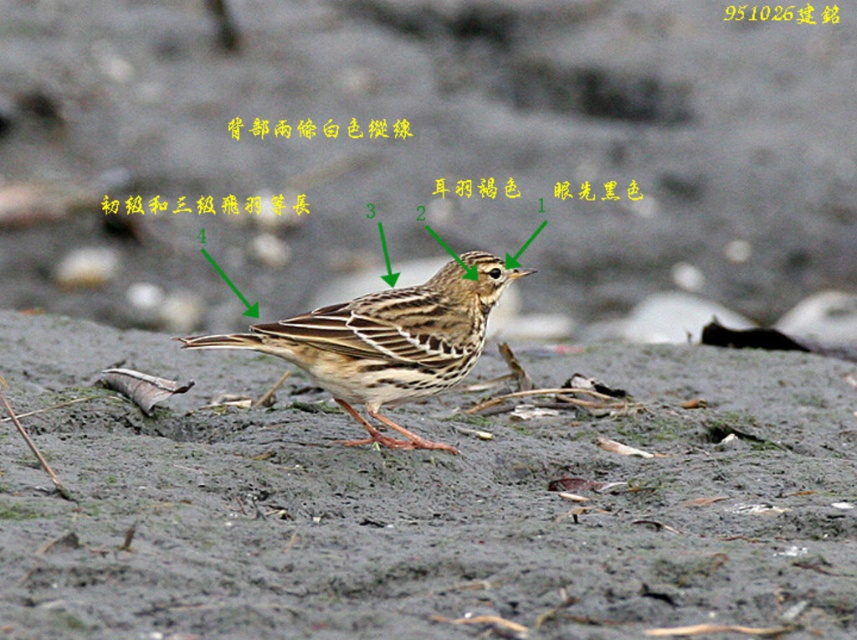
Question: Can you confirm if brown matte mud at center is positioned above brown speckled bird at center?

Choices:
 (A) no
 (B) yes

Answer: (A)

Question: Is brown matte mud at center bigger than brown speckled bird at center?

Choices:
 (A) yes
 (B) no

Answer: (A)

Question: Which point is closer to the camera?

Choices:
 (A) (489, 301)
 (B) (19, 518)

Answer: (B)

Question: Which object appears closest to the camera in this image?

Choices:
 (A) brown speckled bird at center
 (B) brown matte mud at center

Answer: (B)

Question: Can you confirm if brown matte mud at center is wider than brown speckled bird at center?

Choices:
 (A) yes
 (B) no

Answer: (A)